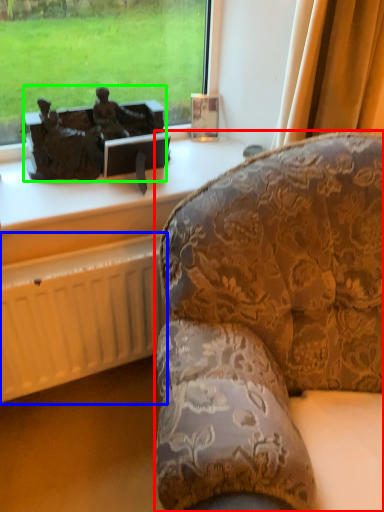
Question: Based on their relative distances, which object is farther from studio couch (highlighted by a red box)? Choose from radiator (highlighted by a blue box) and antique (highlighted by a green box).

Choices:
 (A) radiator
 (B) antique

Answer: (B)